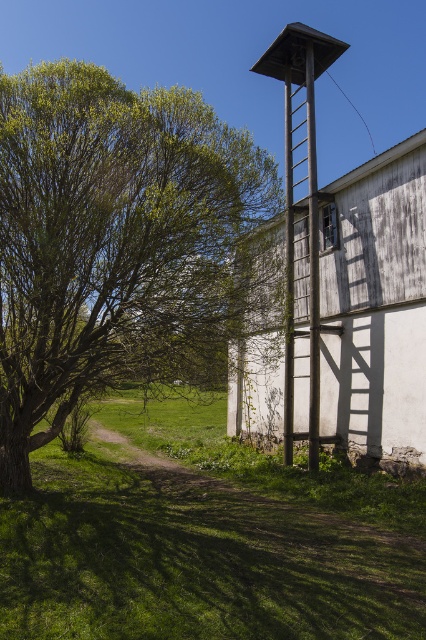
Describe the element at coordinates (111, 237) in the screenshot. The height and width of the screenshot is (640, 426). I see `green leafy tree at left` at that location.

In the scene shown: Measure the distance between point (74, 115) and camera.

Point (74, 115) is 7.07 meters from camera.

Identify the location of green leafy tree at left. This screenshot has width=426, height=640. (111, 237).